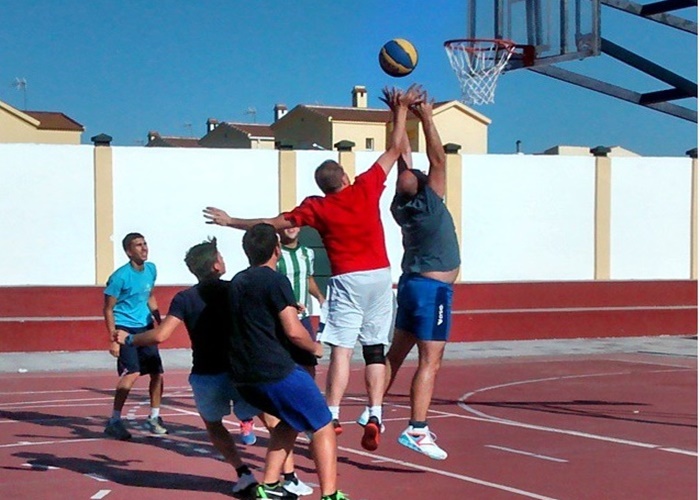
Locate an element on the screen. This screenshot has height=500, width=700. white section of wall is located at coordinates (63, 214), (172, 211), (304, 174), (370, 158), (577, 184), (640, 183).